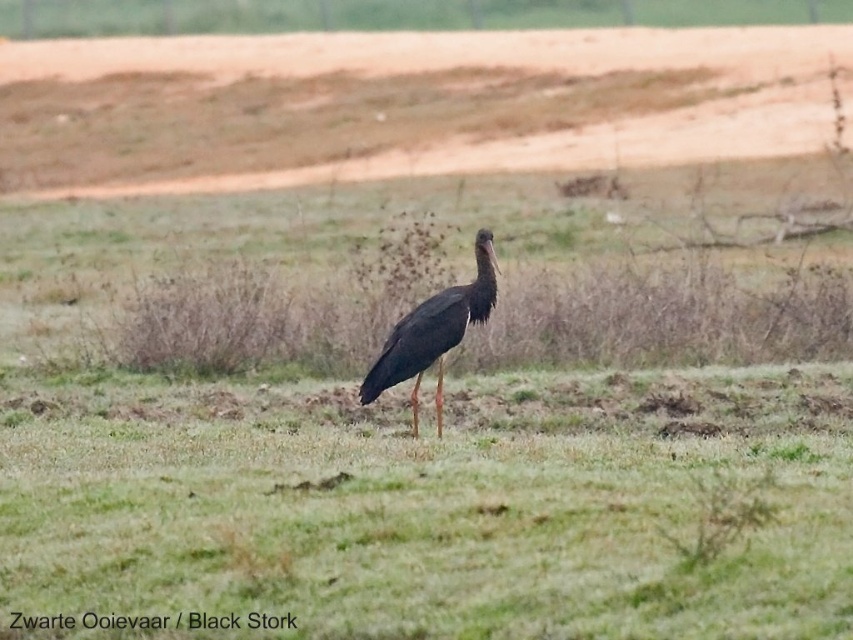
Can you confirm if brown sandy dirt at upper center is taller than matte black stork at center?

Correct, brown sandy dirt at upper center is much taller as matte black stork at center.

Is brown sandy dirt at upper center below matte black stork at center?

No, brown sandy dirt at upper center is not below matte black stork at center.

Between point (59, 170) and point (379, 362), which one is positioned in front?

Point (379, 362)

At what (x,y) coordinates should I click in order to perform the action: click on brown sandy dirt at upper center. Please return your answer as a coordinate pair (x, y). This screenshot has height=640, width=853. Looking at the image, I should click on (405, 104).